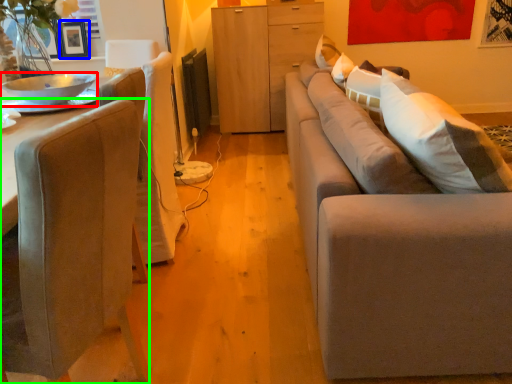
Question: Based on their relative distances, which object is nearer to bowl (highlighted by a red box)? Choose from picture frame (highlighted by a blue box) and chair (highlighted by a green box).

Choices:
 (A) picture frame
 (B) chair

Answer: (B)